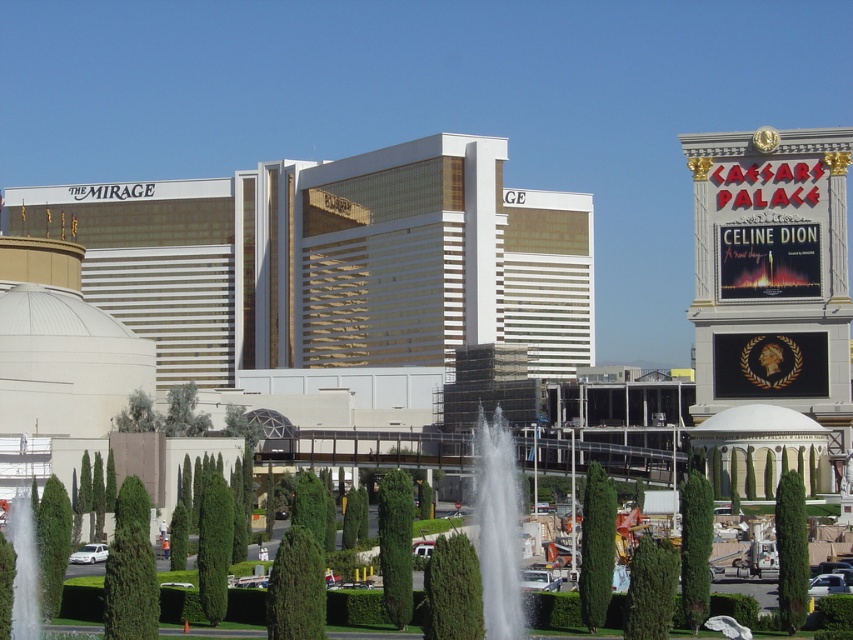
Does gold reflective building at center appear over white water at center?

Yes, gold reflective building at center is above white water at center.

Is gold reflective building at center thinner than white water at center?

Incorrect, gold reflective building at center's width is not less than white water at center's.

Identify the location of gold reflective building at center. Image resolution: width=853 pixels, height=640 pixels. (334, 260).

Does white glossy building at center have a smaller size compared to gold reflective building at center?

Actually, white glossy building at center might be larger than gold reflective building at center.

Which is in front, point (103, 280) or point (115, 227)?

Positioned in front is point (103, 280).

The image size is (853, 640). What are the coordinates of `white glossy building at center` in the screenshot? It's located at (334, 260).

Can you confirm if white glossy building at center is positioned to the right of white water at center?

Yes, white glossy building at center is to the right of white water at center.

Who is higher up, white glossy building at center or white water at center?

white glossy building at center

Is point (721, 312) behind point (490, 563)?

Yes, it is.

Locate an element on the screen. The width and height of the screenshot is (853, 640). white glossy building at center is located at coordinates (334, 260).